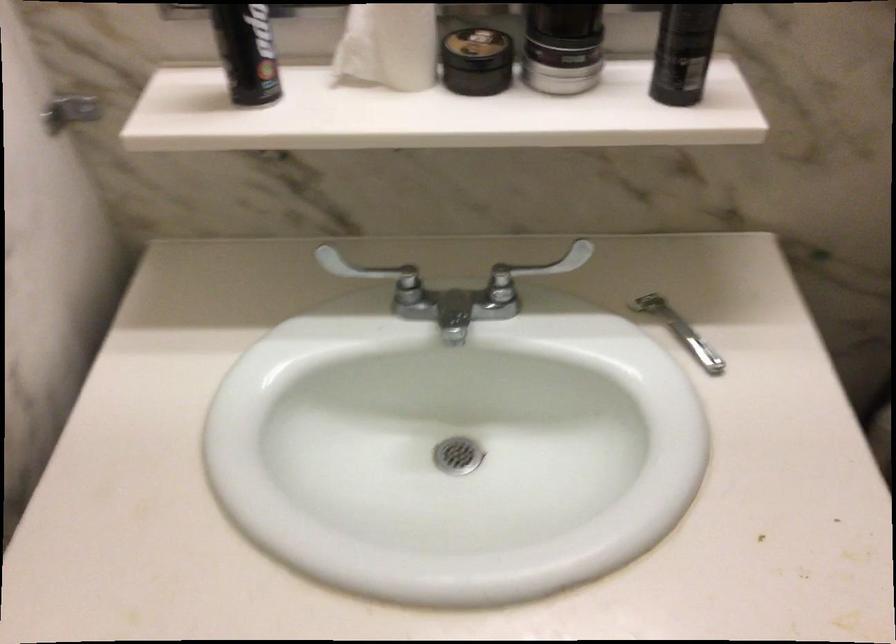
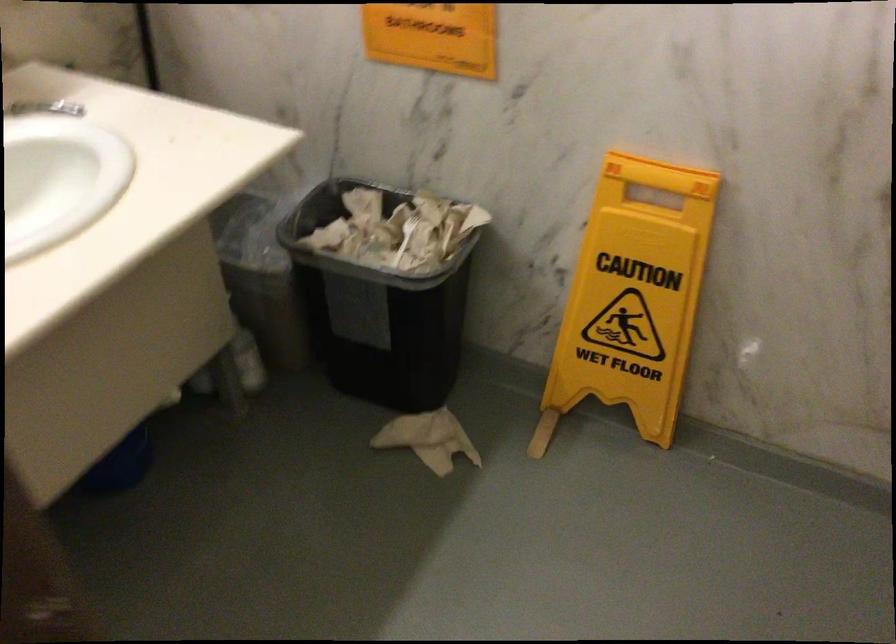
Question: The camera is either moving clockwise (left) or counter-clockwise (right) around the object. The first image is from the beginning of the video and the second image is from the end. Is the camera moving left or right when shooting the video?

Choices:
 (A) Left
 (B) Right

Answer: (A)